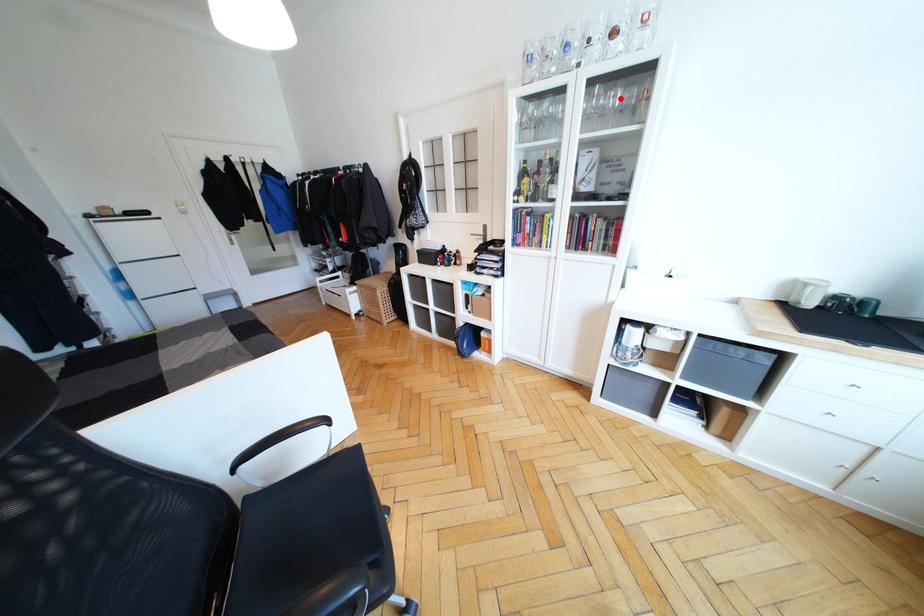
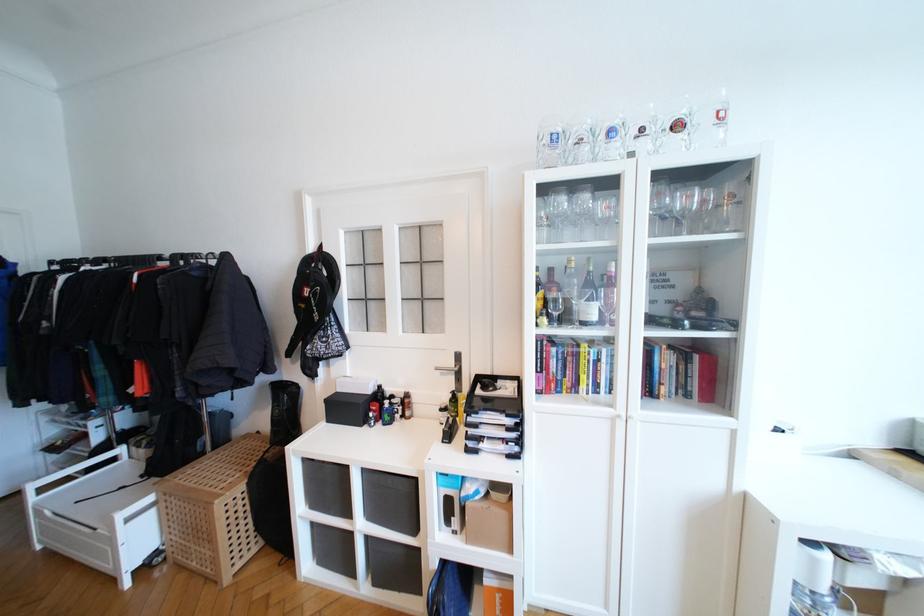
Locate, in the second image, the point that corresponds to the highlighted location in the first image.

(691, 200)